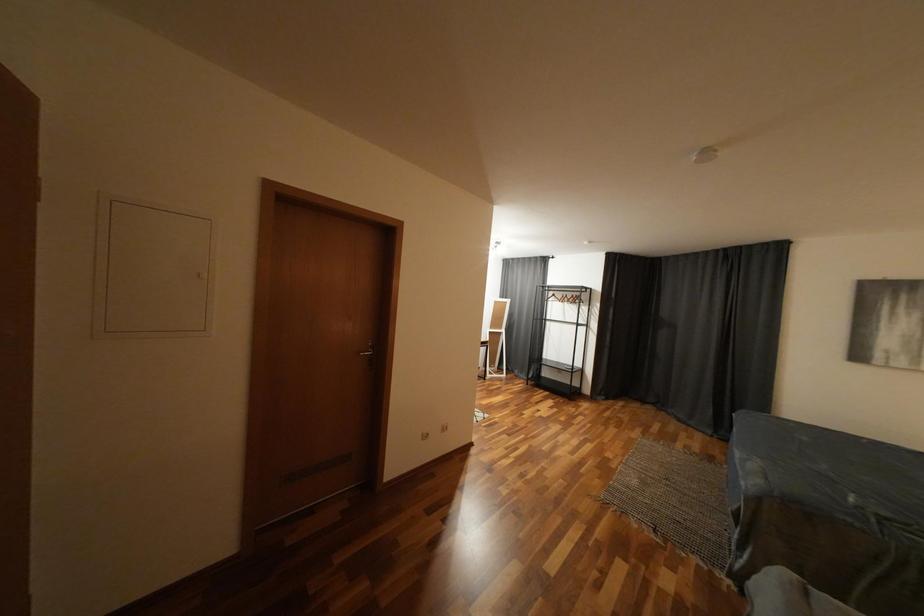
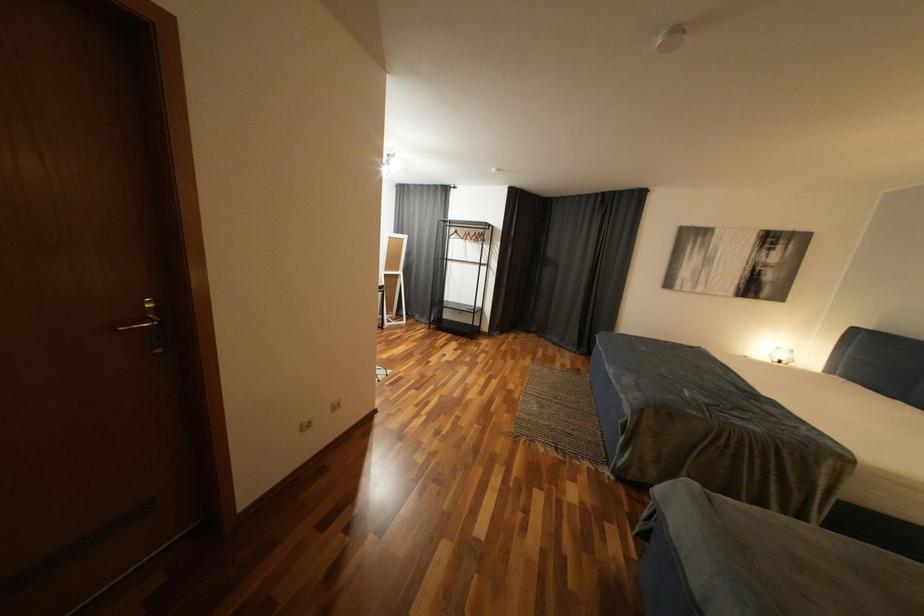
Question: How did the camera likely rotate?

Choices:
 (A) Left
 (B) Right
 (C) Up
 (D) Down

Answer: (B)